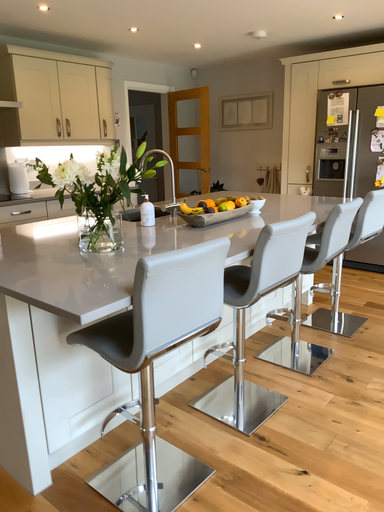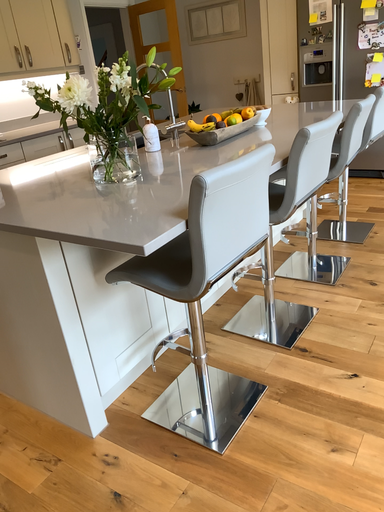
Question: How did the camera likely rotate when shooting the video?

Choices:
 (A) rotated downward
 (B) rotated upward

Answer: (A)